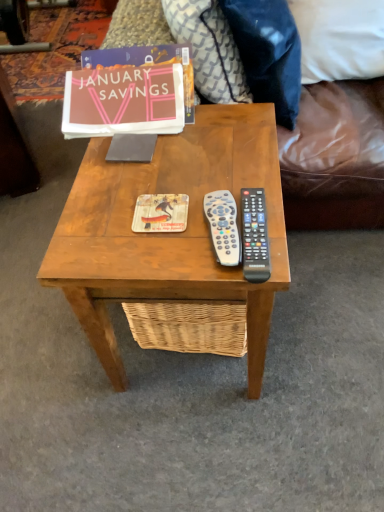
Where is `vacant space that is in between wooden coffee table at center and brown fabric couch at upper center`? vacant space that is in between wooden coffee table at center and brown fabric couch at upper center is located at coordinates (325, 303).